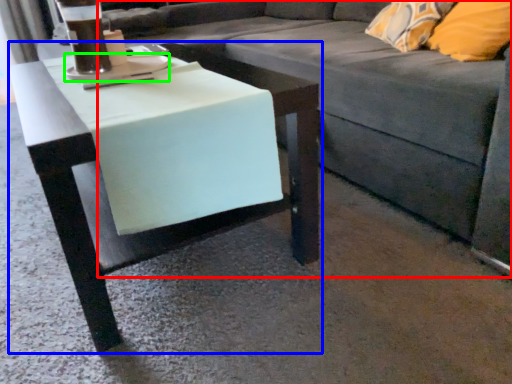
Question: Which object is positioned farthest from studio couch (highlighted by a red box)? Select from table (highlighted by a blue box) and saucer (highlighted by a green box).

Choices:
 (A) table
 (B) saucer

Answer: (B)